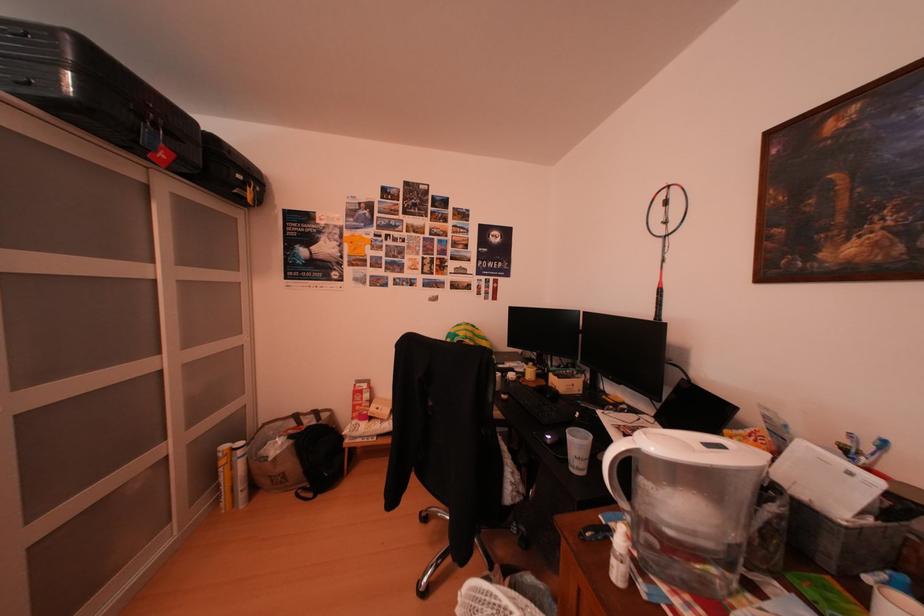
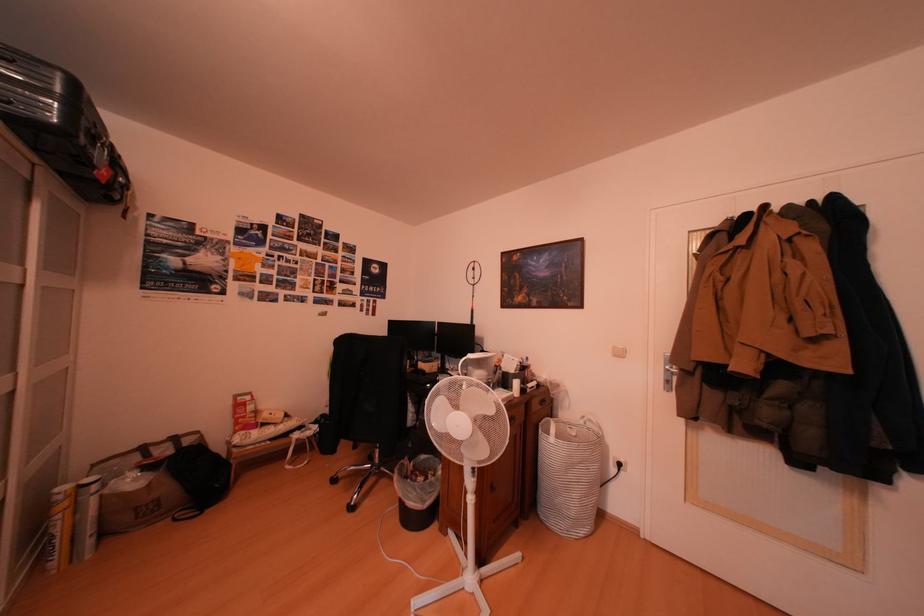
Question: The camera is either moving clockwise (left) or counter-clockwise (right) around the object. The first image is from the beginning of the video and the second image is from the end. Is the camera moving left or right when shooting the video?

Choices:
 (A) Left
 (B) Right

Answer: (A)